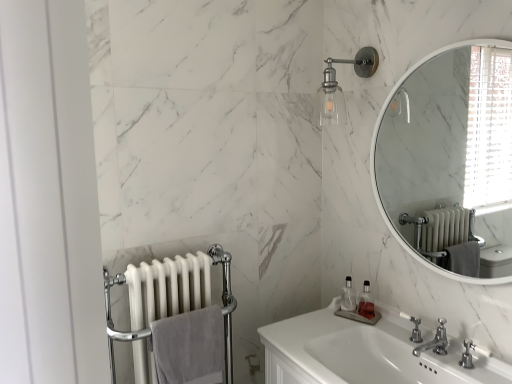
This screenshot has height=384, width=512. I want to click on free space between translucent glass soap dispenser at lower center, which is counted as the 2th soap dispenser, starting from the left, and white plastic faucet at lower right, the first plumbing fixture positioned from the back, so click(383, 331).